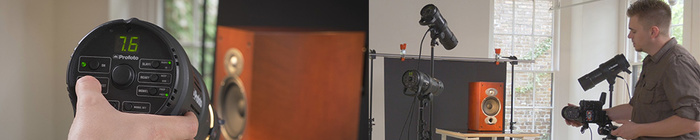
The image size is (700, 140). Identify the location of backdrop. (449, 82).